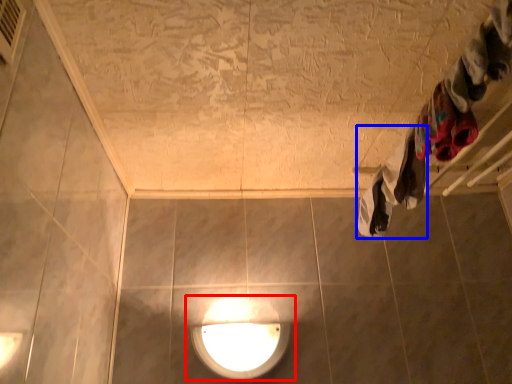
Question: Which point is further to the camera, lamp (highlighted by a red box) or clothing (highlighted by a blue box)?

Choices:
 (A) lamp
 (B) clothing

Answer: (A)